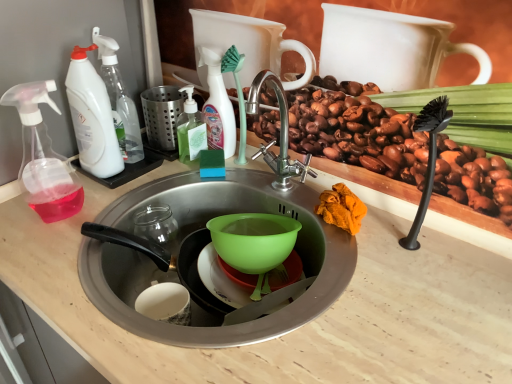
Question: From the image's perspective, is green translucent soap dispenser at center above or below translucent plastic spray bottle at upper center, which is counted as the 1th cleaning product, starting from the right?

Choices:
 (A) above
 (B) below

Answer: (B)

Question: Is green translucent soap dispenser at center in front of or behind translucent plastic spray bottle at upper center, the third cleaning product positioned from the left, in the image?

Choices:
 (A) front
 (B) behind

Answer: (B)

Question: Based on their relative distances, which object is nearer to the white plastic spray bottle at left, placed as the 2th cleaning product when sorted from left to right?

Choices:
 (A) matte stainless steel sink at center
 (B) transparent plastic soap dispenser at left
 (C) green plastic brush at upper center
 (D) white plastic spray bottle at left, which ranks as the 3th cleaning product in right-to-left order
 (E) green translucent soap dispenser at center

Answer: (D)

Question: Estimate the real-world distances between objects in this image. Which object is closer to the white plastic spray bottle at left, the 2th cleaning product in the right-to-left sequence?

Choices:
 (A) translucent plastic spray bottle at upper center, the third cleaning product positioned from the left
 (B) green translucent soap dispenser at center
 (C) green plastic brush at upper center
 (D) transparent plastic soap dispenser at left
 (E) matte stainless steel sink at center

Answer: (B)